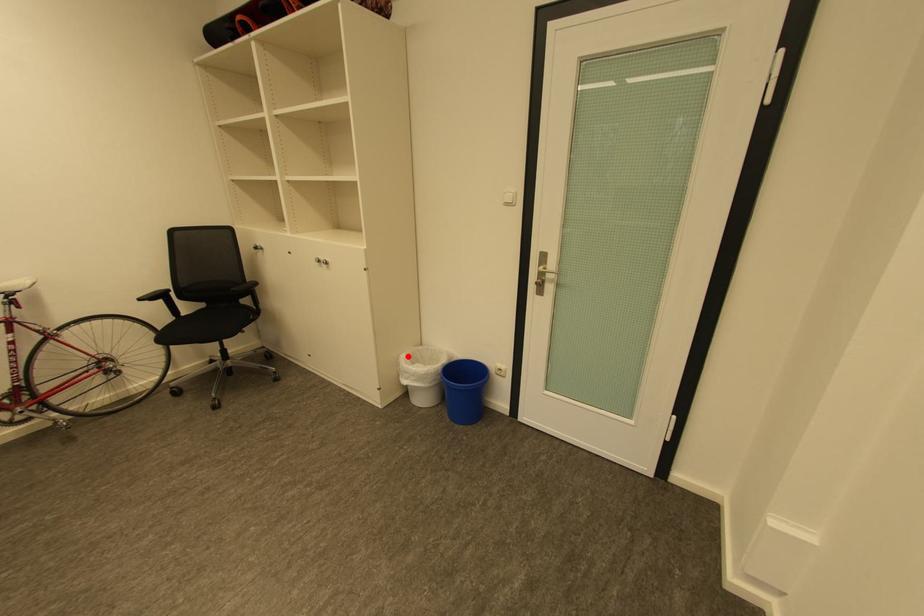
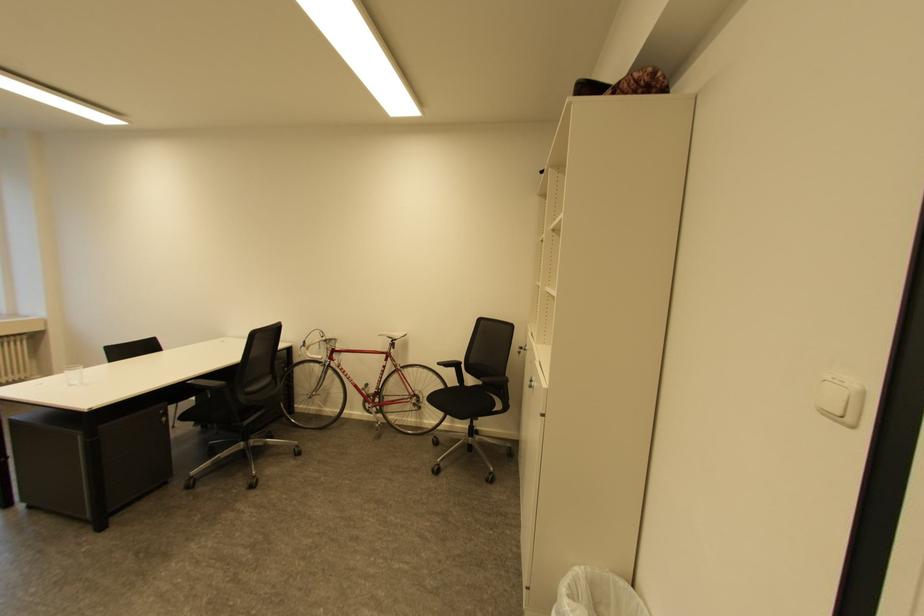
In the second image, find the point that corresponds to the highlighted location in the first image.

(579, 569)